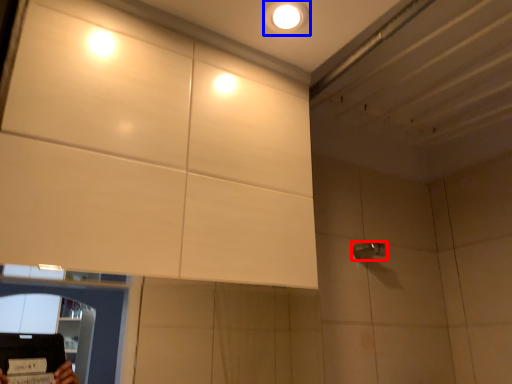
Question: Which point is closer to the camera, shower (highlighted by a red box) or droplight (highlighted by a blue box)?

Choices:
 (A) shower
 (B) droplight

Answer: (B)